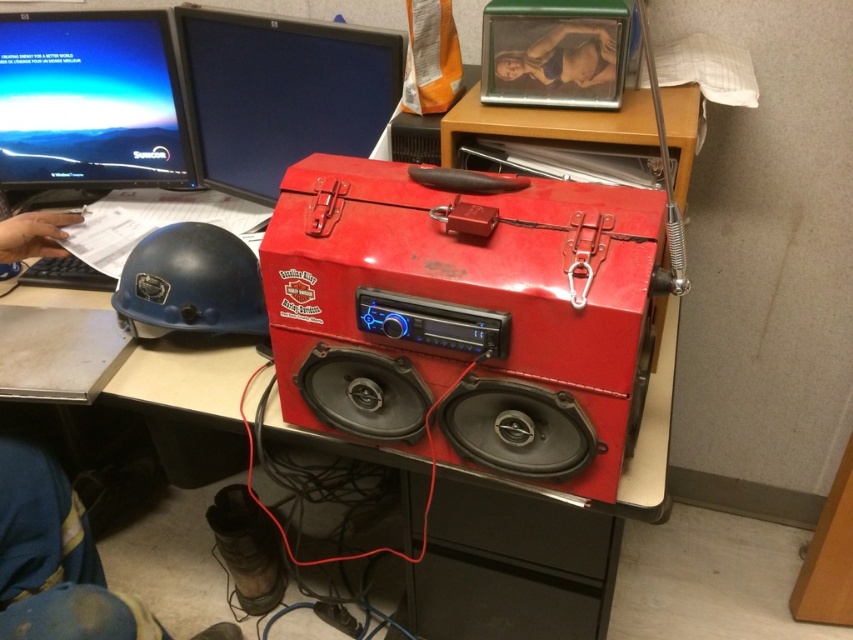
You are an engineer working in a construction site office. You need to locate the glossy plastic speaker at center on your desk. Where exactly is it positioned relative to the desk?

The glossy plastic speaker at center is positioned at the coordinates point [463,317] on the desk.

You are an office worker who needs to place a new document holder that requires 10 cm of vertical space. You have two options on the desk where the glossy plastic speaker at center and the matte black monitor at upper center are located. Which object should you place it next to to ensure enough vertical space?

The glossy plastic speaker at center is much taller than the matte black monitor at upper center, so placing the document holder next to the matte black monitor at upper center would provide sufficient vertical space since it is shorter.

You are organizing the desk and need to place the glossy plastic speaker at center and the blue hard plastic helmet at left. According to the current arrangement, which object is positioned lower on the desk?

The glossy plastic speaker at center is positioned below the blue hard plastic helmet at left, so it is lower on the desk.